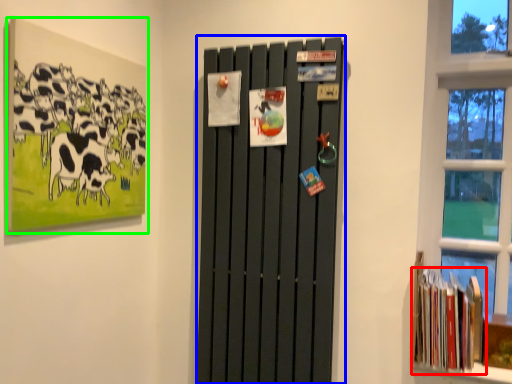
Question: Based on their relative distances, which object is farther from book (highlighted by a red box)? Choose from barn door (highlighted by a blue box) and picture frame (highlighted by a green box).

Choices:
 (A) barn door
 (B) picture frame

Answer: (B)